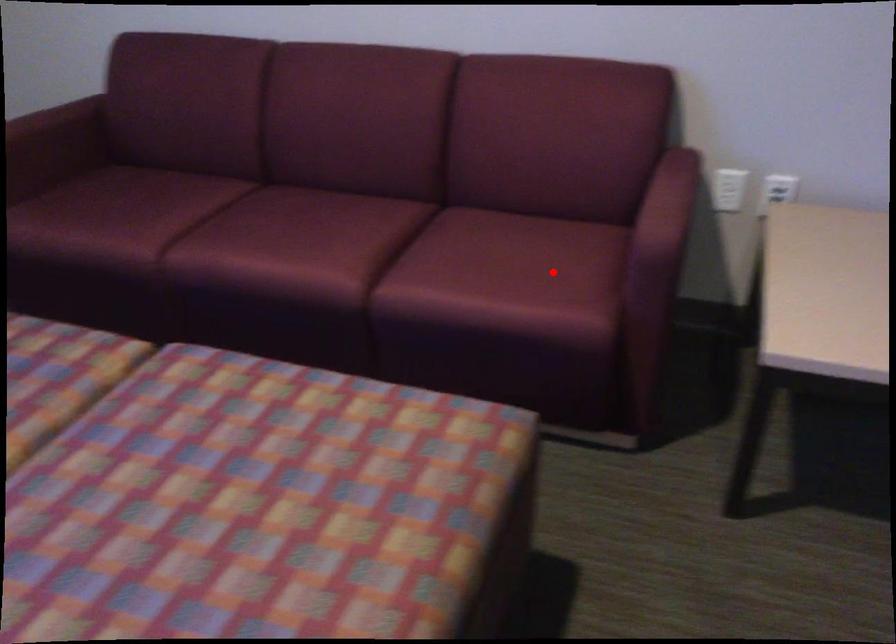
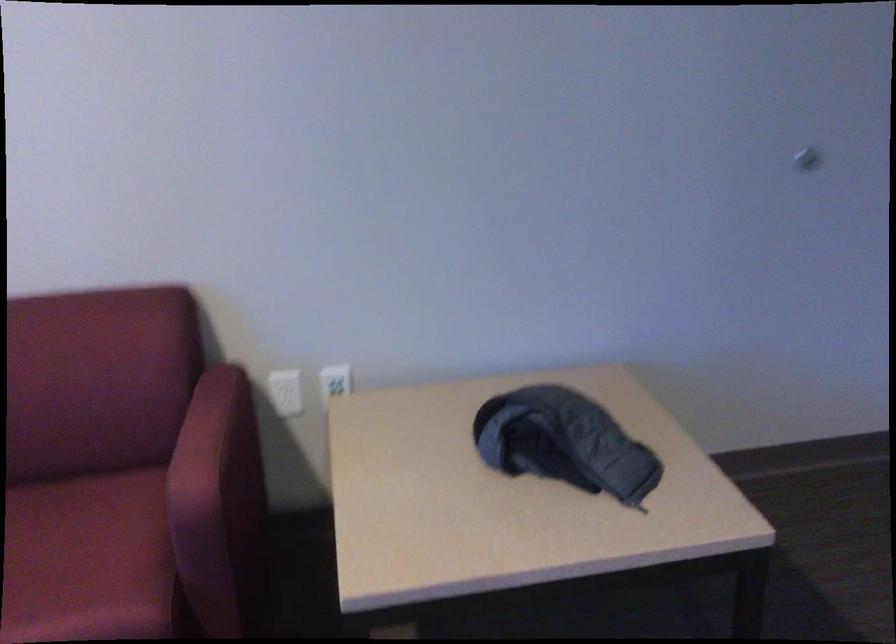
Question: I am providing you with two images of the same scene from different viewpoints. Image1 has a red point marked. In image2, the corresponding 3D location appears at what relative position? Reply with the corresponding letter.

Choices:
 (A) Closer
 (B) Farther

Answer: (A)